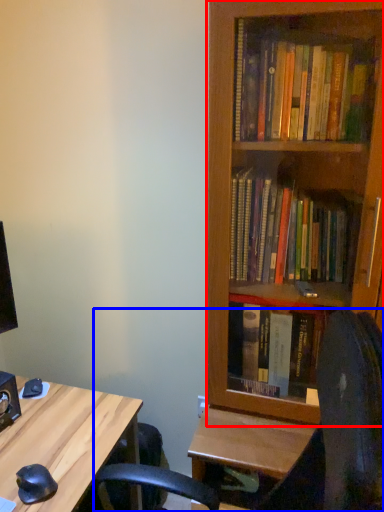
Question: Among these objects, which one is nearest to the camera, bookcase (highlighted by a red box) or computer chair (highlighted by a blue box)?

Choices:
 (A) bookcase
 (B) computer chair

Answer: (B)